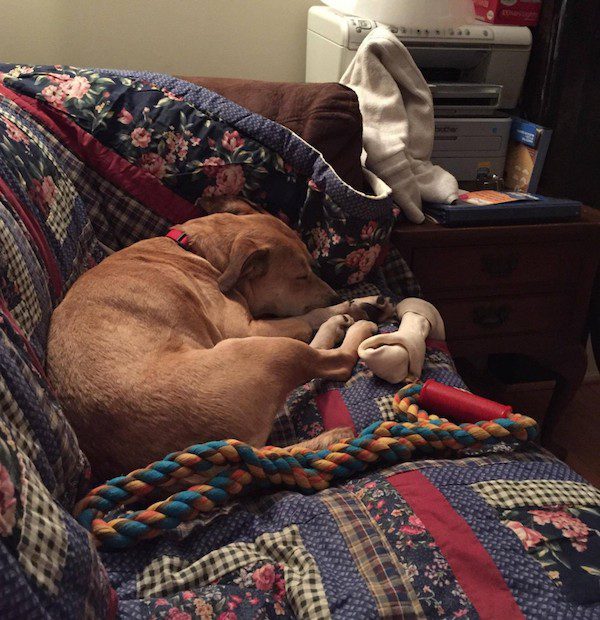
Where is `sofa`? This screenshot has height=620, width=600. sofa is located at coordinates (263, 105).